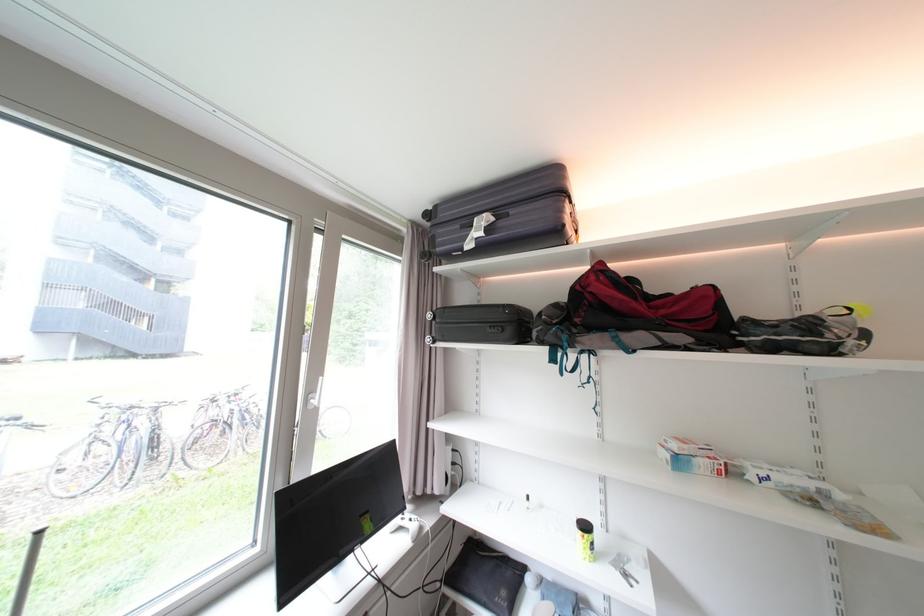
Where is `small black bottle`? This screenshot has width=924, height=616. small black bottle is located at coordinates (585, 539).